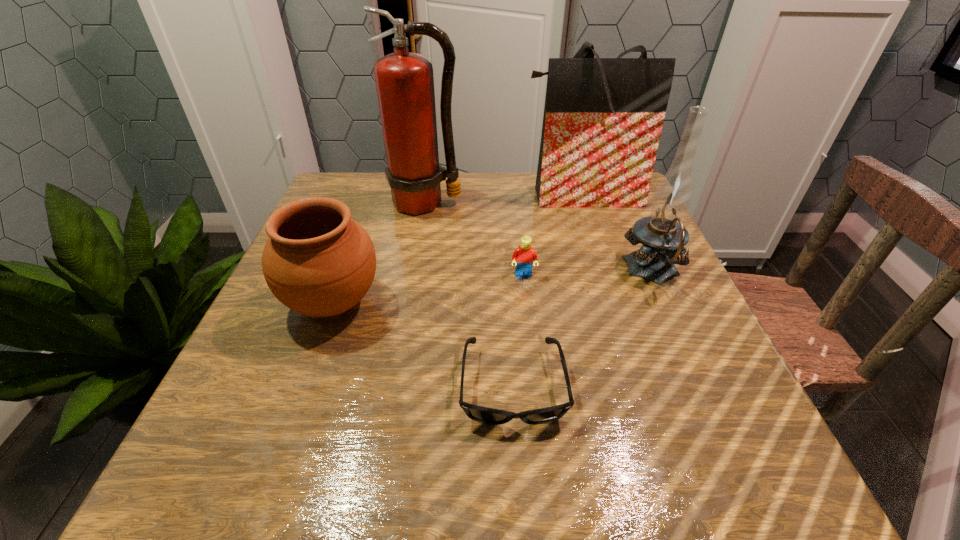
Where is `vacant region at the near edge of the desktop`? vacant region at the near edge of the desktop is located at coordinates [x=313, y=454].

You are a GUI agent. You are given a task and a screenshot of the screen. Output one action in this format:
    pyautogui.click(x=<x>, y=<y>)
    Task: Click on the vacant area at the left edge of the desktop
    Image resolution: width=960 pixels, height=540 pixels.
    Given the screenshot: What is the action you would take?
    pos(306,318)

This screenshot has width=960, height=540. I want to click on vacant space at the right edge of the desktop, so click(x=599, y=247).

Where is `vacant space at the far left corner of the desktop`? The height and width of the screenshot is (540, 960). vacant space at the far left corner of the desktop is located at coordinates (359, 209).

Locate an element on the screen. The height and width of the screenshot is (540, 960). free region at the near left corner of the desktop is located at coordinates (278, 496).

Locate an element on the screen. vacant point located between the tallest object and the pottery is located at coordinates (379, 253).

You are a GUI agent. You are given a task and a screenshot of the screen. Output one action in this format:
    pyautogui.click(x=<x>, y=<y>)
    Task: Click on the empty space between the oil lamp and the nearest object
    
    Given the screenshot: What is the action you would take?
    pyautogui.click(x=583, y=329)

What are the coordinates of `free area in between the shopping bag and the fire extinguisher` in the screenshot? It's located at (503, 199).

Locate an element on the screen. The image size is (960, 540). unoccupied area between the Lego and the shopping bag is located at coordinates (552, 235).

Find the location of a particular element. The width and height of the screenshot is (960, 540). vacant space in between the oil lamp and the tallest object is located at coordinates (539, 237).